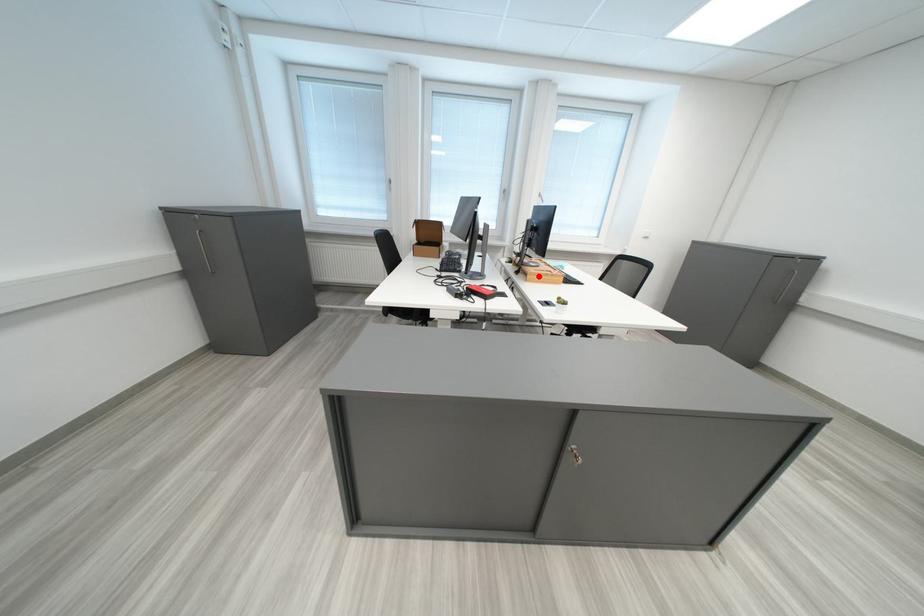
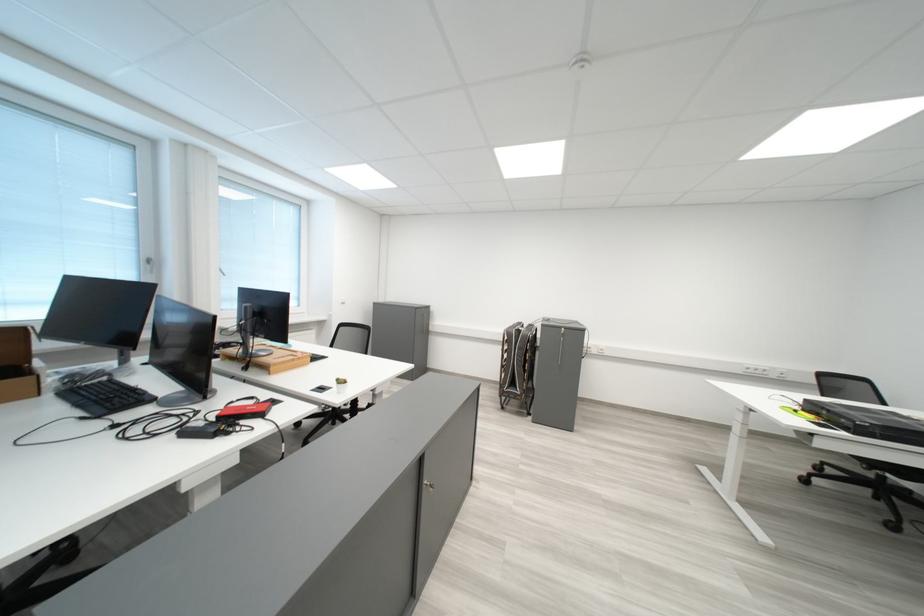
Question: I am providing you with two images of the same scene from different viewpoints. A red point is marked on the first image. Can you still see the location of the red point in image 2?

Choices:
 (A) Yes
 (B) No

Answer: (A)